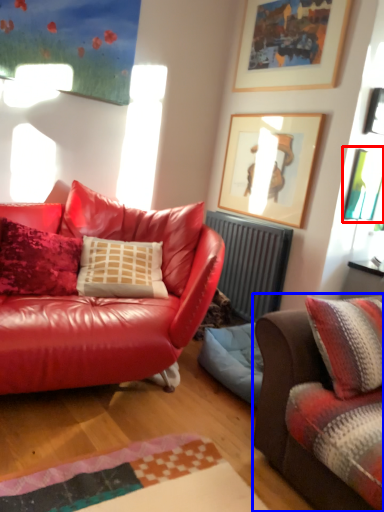
Question: Among these objects, which one is nearest to the camera, picture frame (highlighted by a red box) or studio couch (highlighted by a blue box)?

Choices:
 (A) picture frame
 (B) studio couch

Answer: (B)